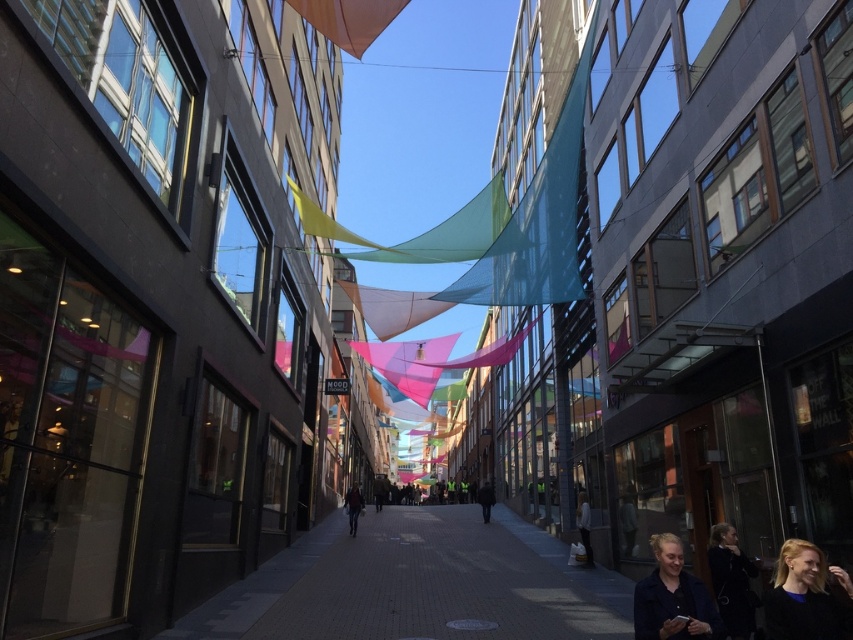
Looking at this image, you are a delivery person carrying a package that requires a coat to protect it from the weather. You see a dark blue sweater at lower right and a dark gray jacket at center. Which item would be more suitable for covering the package?

The dark gray jacket at center is more suitable because it is thicker than the dark blue sweater at lower right.

You are standing on the narrow urban street scene and want to take a photo of the point at coordinates (345, 538). If your camera has a focal length of 50mm, what is the approximate distance in meters between you and the point?

The point at coordinates (345, 538) is 17.06 meters away from the camera, so the distance between you and the point is approximately 17.06 meters.